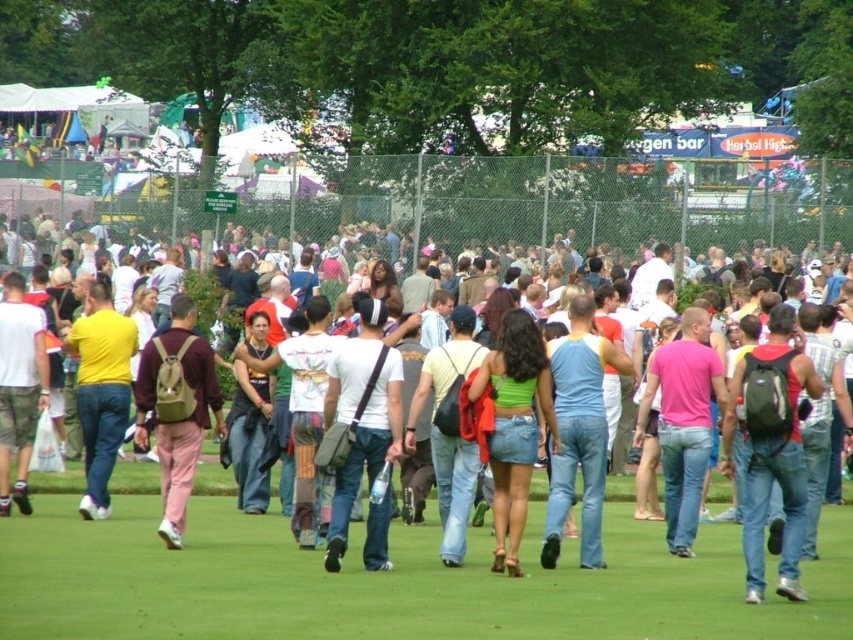
Which is more to the left, green grass at center or white cotton t-shirt at center?

white cotton t-shirt at center is more to the left.

Is green grass at center shorter than white cotton t-shirt at center?

Yes.

Is point (741, 628) closer to camera compared to point (345, 397)?

That is True.

The width and height of the screenshot is (853, 640). In order to click on green grass at center in this screenshot , I will do `click(392, 580)`.

Which of these two, green denim skirt at center or pink fabric backpack at center, stands shorter?

green denim skirt at center is shorter.

Does point (512, 413) lie in front of point (338, 291)?

Yes, point (512, 413) is closer to viewer.

The height and width of the screenshot is (640, 853). In order to click on green denim skirt at center in this screenshot , I will do `click(514, 426)`.

Between green grass at center and pink fabric backpack at center, which one is positioned lower?

Positioned lower is green grass at center.

Who is higher up, green grass at center or pink fabric backpack at center?

pink fabric backpack at center

Who is more forward, (453, 577) or (61, 474)?

Point (453, 577)

At what (x,y) coordinates should I click in order to perform the action: click on green grass at center. Please return your answer as a coordinate pair (x, y). Looking at the image, I should click on (392, 580).